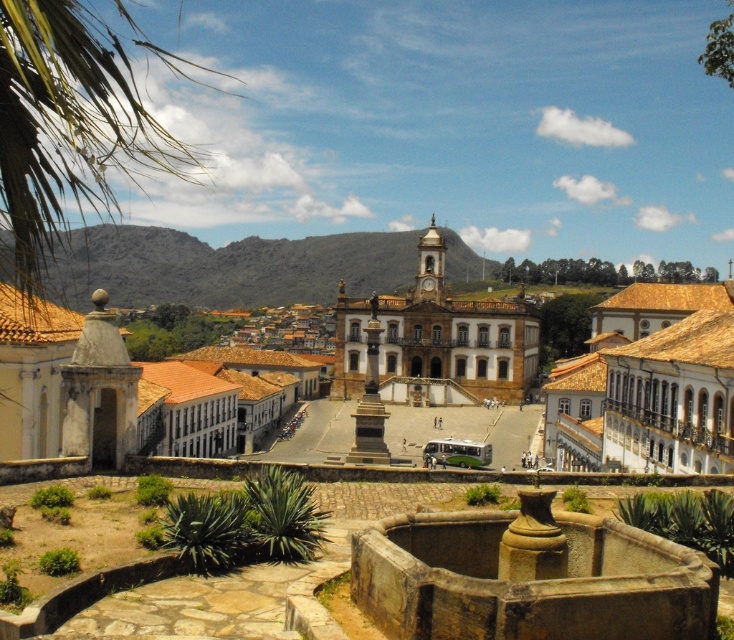
Does green leafy palm at upper left lie in front of white stone town at center?

Yes.

Does green leafy palm at upper left appear under white stone town at center?

No.

What do you see at coordinates (68, 129) in the screenshot?
I see `green leafy palm at upper left` at bounding box center [68, 129].

Identify the location of green leafy palm at upper left. (68, 129).

Find the location of a particular element. The width and height of the screenshot is (734, 640). green leafy palm at upper left is located at coordinates (68, 129).

Which is in front, point (106, 152) or point (401, 348)?

Positioned in front is point (106, 152).

Is point (26, 152) in front of point (515, 326)?

That is True.

The image size is (734, 640). I want to click on green leafy palm at upper left, so click(x=68, y=129).

Who is lower down, brown/white stone building at center-right or brown stone building at center?

brown/white stone building at center-right

Consider the image. Is brown/white stone building at center-right shorter than brown stone building at center?

Indeed, brown/white stone building at center-right has a lesser height compared to brown stone building at center.

Which is behind, point (679, 339) or point (374, 301)?

The point (374, 301) is behind.

The image size is (734, 640). I want to click on brown/white stone building at center-right, so click(x=650, y=385).